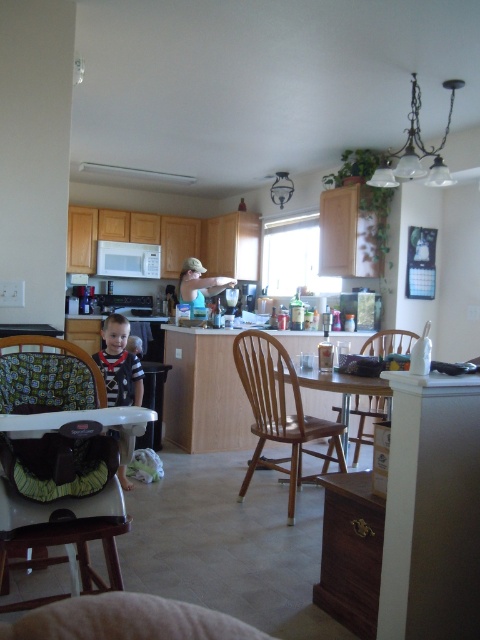
Who is positioned more to the left, brown wood chair at center or striped fabric high chair at left?

striped fabric high chair at left is more to the left.

The width and height of the screenshot is (480, 640). What do you see at coordinates (277, 410) in the screenshot?
I see `brown wood chair at center` at bounding box center [277, 410].

Is point (269, 404) closer to camera compared to point (119, 342)?

Yes, point (269, 404) is in front of point (119, 342).

This screenshot has width=480, height=640. Identify the location of brown wood chair at center. (277, 410).

Is point (8, 449) positioned before point (338, 417)?

Yes, it is in front of point (338, 417).

The height and width of the screenshot is (640, 480). Describe the element at coordinates (61, 502) in the screenshot. I see `green fabric highchair at lower left` at that location.

Locate an element on the screen. green fabric highchair at lower left is located at coordinates (61, 502).

Does point (347, 422) come behind point (386, 336)?

No.

This screenshot has width=480, height=640. Find the location of `wooden table at center`. wooden table at center is located at coordinates (348, 397).

The width and height of the screenshot is (480, 640). Find the location of `wooden table at center`. wooden table at center is located at coordinates (348, 397).